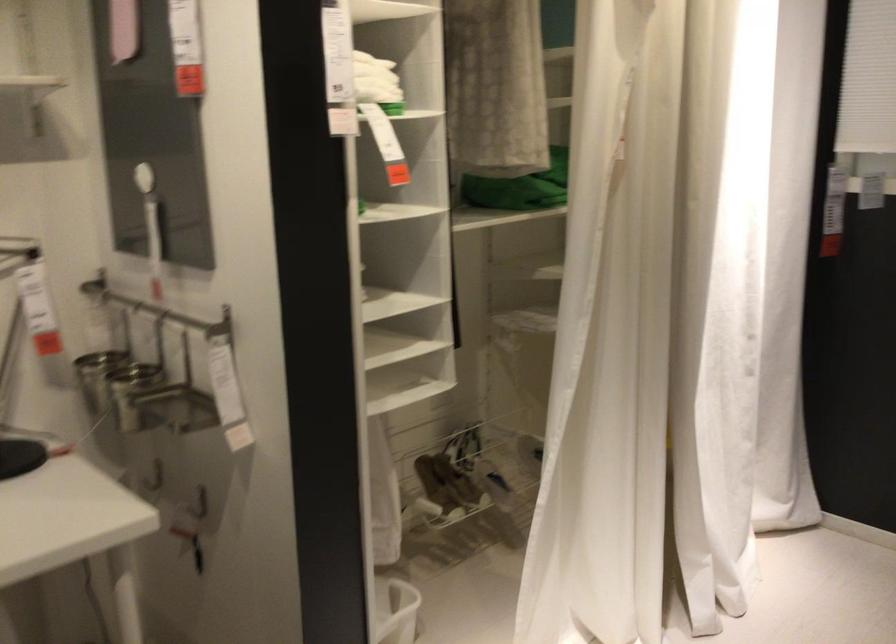
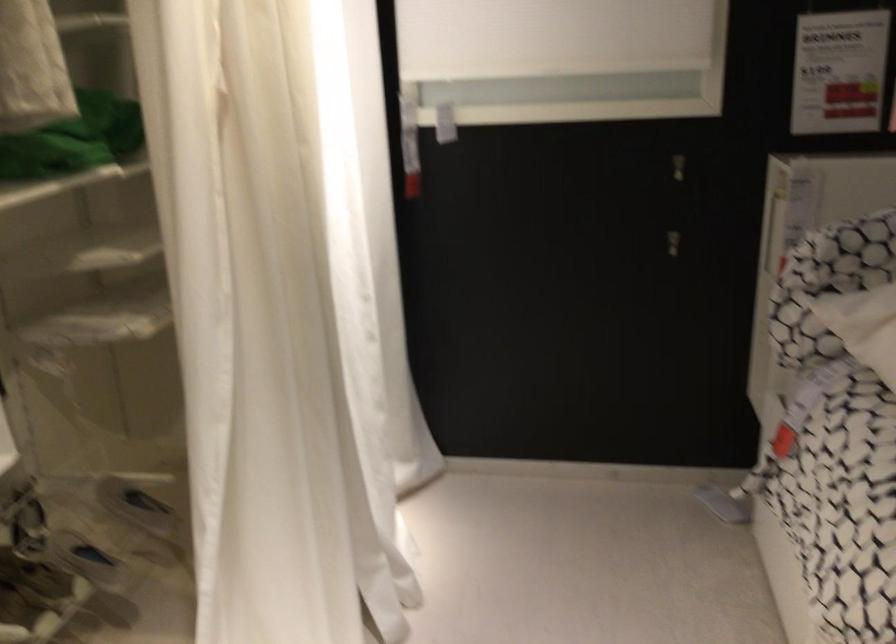
Question: The camera is either moving clockwise (left) or counter-clockwise (right) around the object. The first image is from the beginning of the video and the second image is from the end. Is the camera moving left or right when shooting the video?

Choices:
 (A) Left
 (B) Right

Answer: (A)